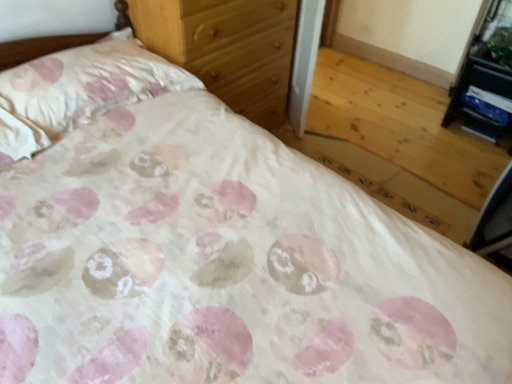
Image resolution: width=512 pixels, height=384 pixels. What do you see at coordinates (226, 48) in the screenshot?
I see `wooden chest of drawers at upper center` at bounding box center [226, 48].

Find the location of a particular element. This screenshot has width=512, height=384. black plastic vanity at upper right is located at coordinates (486, 78).

How different are the orientations of wooden chest of drawers at upper center and pink satin pillow at upper left in degrees?

They differ by 1.76 degrees in their facing directions.

Is wooden chest of drawers at upper center not close to pink satin pillow at upper left?

Actually, wooden chest of drawers at upper center and pink satin pillow at upper left are a little close together.

Between wooden chest of drawers at upper center and pink satin pillow at upper left, which one appears on the left side from the viewer's perspective?

Positioned to the left is pink satin pillow at upper left.

From a real-world perspective, between wooden chest of drawers at upper center and pink satin pillow at upper left, who is vertically higher?

In real-world perspective, pink satin pillow at upper left is above.

Considering the relative sizes of pink satin pillow at upper left and wooden chest of drawers at upper center in the image provided, is pink satin pillow at upper left bigger than wooden chest of drawers at upper center?

No.

From a real-world perspective, who is located higher, pink satin pillow at upper left or wooden chest of drawers at upper center?

pink satin pillow at upper left, from a real-world perspective.

From the picture: Which object is further away from the camera, pink satin pillow at upper left or wooden chest of drawers at upper center?

wooden chest of drawers at upper center is more distant.

From the image's perspective, is pink satin pillow at upper left above wooden chest of drawers at upper center?

Actually, pink satin pillow at upper left appears below wooden chest of drawers at upper center in the image.

Relative to black plastic vanity at upper right, is wooden chest of drawers at upper center in front or behind?

Clearly, wooden chest of drawers at upper center is in front of black plastic vanity at upper right.

Is wooden chest of drawers at upper center looking in the opposite direction of black plastic vanity at upper right?

No, black plastic vanity at upper right is not at the back of wooden chest of drawers at upper center.

The width and height of the screenshot is (512, 384). Identify the location of vanity behind the wooden chest of drawers at upper center. (486, 78).

Are pink satin pillow at upper left and black plastic vanity at upper right far apart?

Yes.

In terms of height, does pink satin pillow at upper left look taller or shorter compared to black plastic vanity at upper right?

In the image, pink satin pillow at upper left appears to be shorter than black plastic vanity at upper right.

Considering the relative sizes of pink satin pillow at upper left and black plastic vanity at upper right in the image provided, is pink satin pillow at upper left thinner than black plastic vanity at upper right?

No, pink satin pillow at upper left is not thinner than black plastic vanity at upper right.

Does black plastic vanity at upper right appear on the right side of pink satin pillow at upper left?

Indeed, black plastic vanity at upper right is positioned on the right side of pink satin pillow at upper left.

Which object is closer to the camera taking this photo, black plastic vanity at upper right or pink satin pillow at upper left?

pink satin pillow at upper left is closer to the camera.

Based on the photo, is black plastic vanity at upper right far away from pink satin pillow at upper left?

That's right, there is a large distance between black plastic vanity at upper right and pink satin pillow at upper left.

Measure the distance from black plastic vanity at upper right to wooden chest of drawers at upper center.

A distance of 4.16 feet exists between black plastic vanity at upper right and wooden chest of drawers at upper center.

From the picture: Is wooden chest of drawers at upper center a part of black plastic vanity at upper right?

No, wooden chest of drawers at upper center is not surrounded by black plastic vanity at upper right.

Which of these two, black plastic vanity at upper right or wooden chest of drawers at upper center, is thinner?

With smaller width is black plastic vanity at upper right.

From the image's perspective, does black plastic vanity at upper right appear higher than wooden chest of drawers at upper center?

Yes, from the image's perspective, black plastic vanity at upper right is over wooden chest of drawers at upper center.

Identify the location of pillow in front of the wooden chest of drawers at upper center. The image size is (512, 384). (80, 89).

You are a GUI agent. You are given a task and a screenshot of the screen. Output one action in this format:
    pyautogui.click(x=<x>, y=<y>)
    Task: Click on the chest of drawers on the right of pink satin pillow at upper left
    Image resolution: width=512 pixels, height=384 pixels.
    Given the screenshot: What is the action you would take?
    pyautogui.click(x=226, y=48)

Looking at this image, which object lies nearer to the anchor point black plastic vanity at upper right, pink satin pillow at upper left or wooden chest of drawers at upper center?

wooden chest of drawers at upper center lies closer to black plastic vanity at upper right than the other object.

Estimate the real-world distances between objects in this image. Which object is further from wooden chest of drawers at upper center, pink satin pillow at upper left or black plastic vanity at upper right?

Based on the image, black plastic vanity at upper right appears to be further to wooden chest of drawers at upper center.

Which object lies nearer to the anchor point wooden chest of drawers at upper center, black plastic vanity at upper right or pink satin pillow at upper left?

pink satin pillow at upper left lies closer to wooden chest of drawers at upper center than the other object.

Considering their positions, is wooden chest of drawers at upper center positioned closer to pink satin pillow at upper left than black plastic vanity at upper right?

Based on the image, wooden chest of drawers at upper center appears to be nearer to pink satin pillow at upper left.

Looking at this image, when comparing their distances from pink satin pillow at upper left, does black plastic vanity at upper right or wooden chest of drawers at upper center seem further?

black plastic vanity at upper right.

Which object lies further to the anchor point black plastic vanity at upper right, wooden chest of drawers at upper center or pink satin pillow at upper left?

The object further to black plastic vanity at upper right is pink satin pillow at upper left.

Identify the location of the chest of drawers situated between pink satin pillow at upper left and black plastic vanity at upper right from left to right. (226, 48).